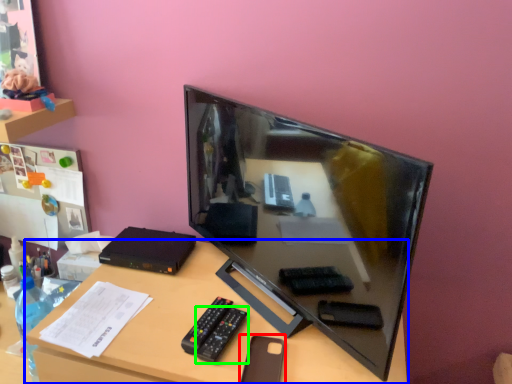
Question: Estimate the real-world distances between objects in this image. Which object is farther from stationery (highlighted by a red box), desk (highlighted by a blue box) or remote (highlighted by a green box)?

Choices:
 (A) desk
 (B) remote

Answer: (A)